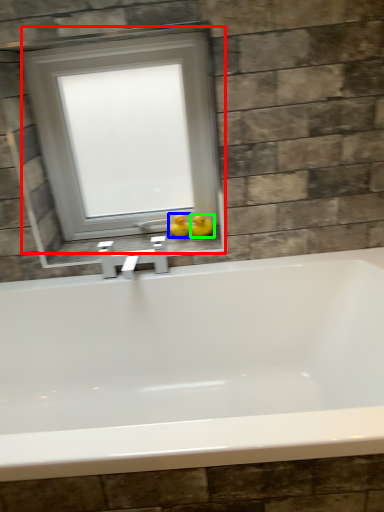
Question: Which is farther away from window (highlighted by a red box)? duck (highlighted by a blue box) or duck (highlighted by a green box)?

Choices:
 (A) duck
 (B) duck

Answer: (B)